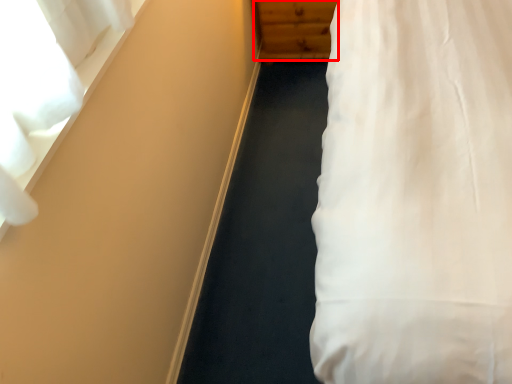
Question: From the image's perspective, considering the relative positions of dresser (annotated by the red box) and curtain in the image provided, where is dresser (annotated by the red box) located with respect to the staircase?

Choices:
 (A) above
 (B) below

Answer: (A)